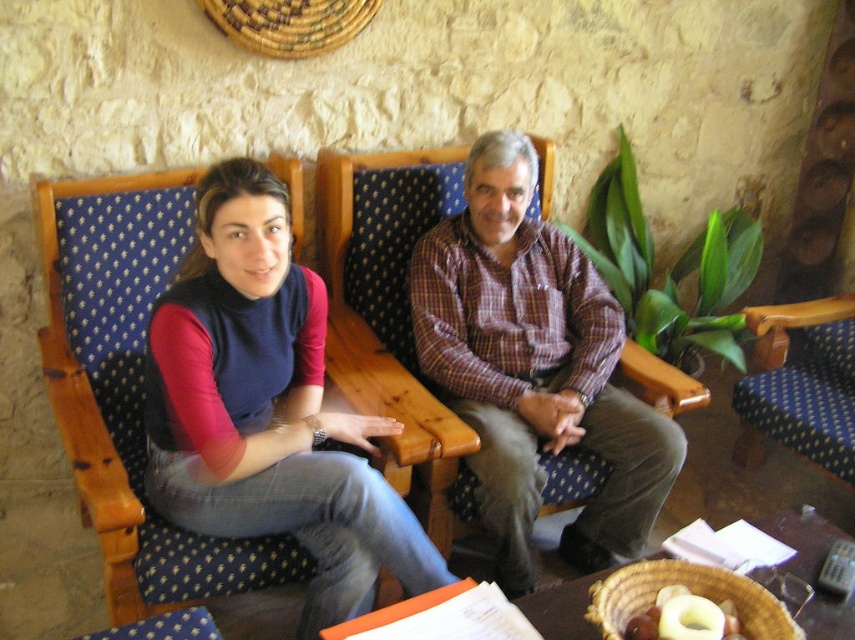
You are trying to decide which item to place in a storage box that can only fit items smaller than the other. Given the items matte blue jeans at center and plaid shirt at center in the image, which one should you choose?

The matte blue jeans at center has a smaller size compared to plaid shirt at center, so you should choose the matte blue jeans at center for the storage box.

You are standing in front of the two people in the scene. Which object is positioned to the right of the other between the matte blue fabric chair at upper left and the matte blue jeans at center?

The matte blue fabric chair at upper left is positioned to the right of the matte blue jeans at center.